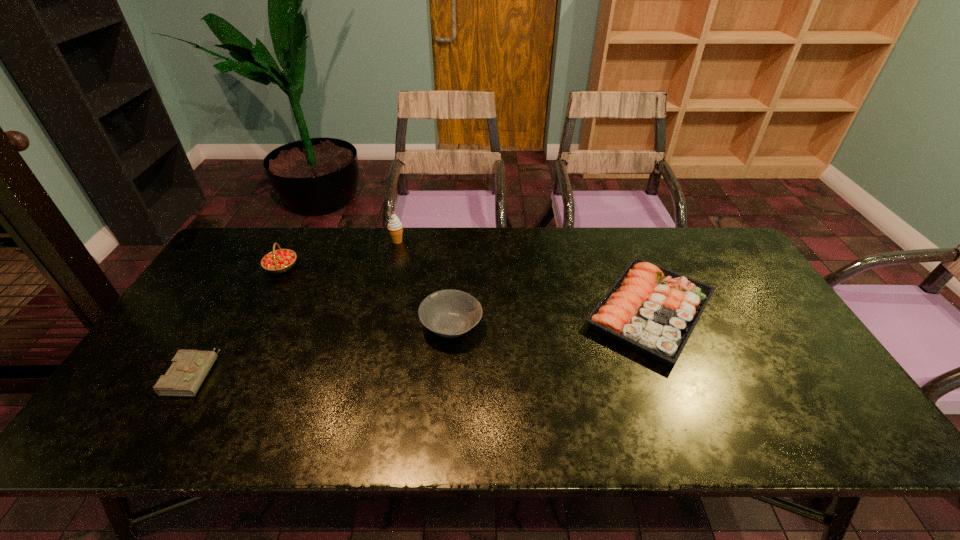
Where is `empty location between the second tallest object and the shortest object`? This screenshot has height=540, width=960. empty location between the second tallest object and the shortest object is located at coordinates (237, 320).

Find the location of a particular element. This screenshot has height=540, width=960. free area in between the second tallest object and the platter is located at coordinates (466, 289).

Locate an element on the screen. vacant area that lies between the platter and the strawberry is located at coordinates (466, 289).

Where is `vacant area that lies between the third shortest object and the second shortest object`? The width and height of the screenshot is (960, 540). vacant area that lies between the third shortest object and the second shortest object is located at coordinates (551, 319).

Identify the location of vacant space in between the tallest object and the bowl. The image size is (960, 540). (424, 284).

Where is `vacant space that is in between the shortest object and the bowl`? vacant space that is in between the shortest object and the bowl is located at coordinates (323, 349).

At what (x,y) coordinates should I click in order to perform the action: click on free spot between the fourth shortest object and the rightmost object. Please return your answer as a coordinate pair (x, y). Looking at the image, I should click on (466, 289).

I want to click on object that stands as the fourth closest to the platter, so click(189, 368).

This screenshot has height=540, width=960. In order to click on the closest object to the shortest object in this screenshot , I will do `click(278, 261)`.

The height and width of the screenshot is (540, 960). I want to click on vacant space that satisfies the following two spatial constraints: 1. on the front side of the bowl; 2. on the right side of the farthest object, so click(377, 326).